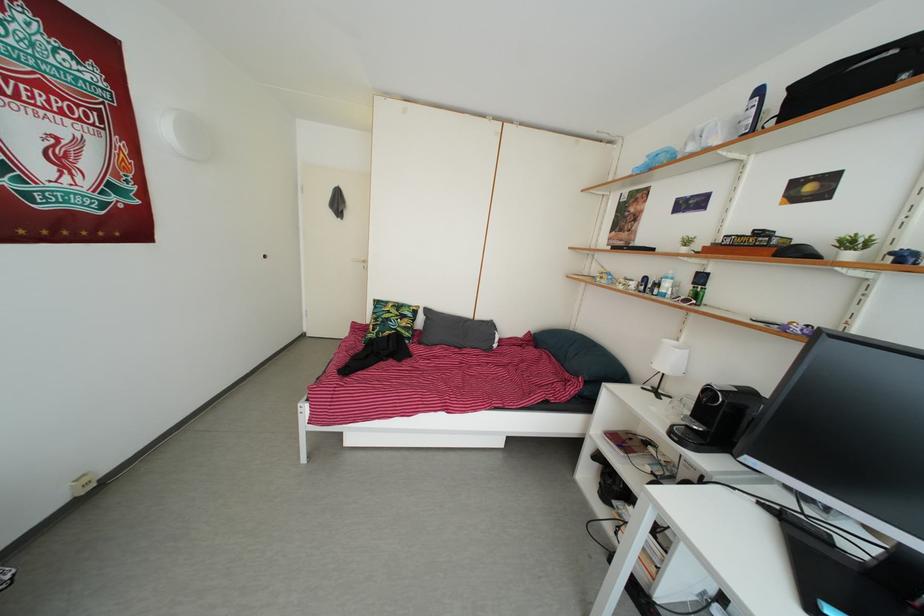
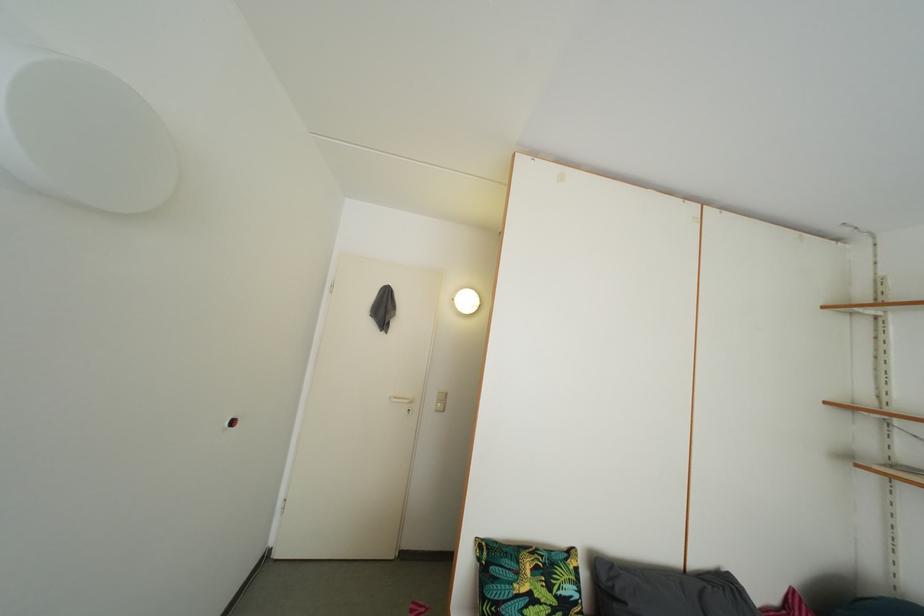
The point at (x=394, y=310) is marked in the first image. Where is the corresponding point in the second image?

(521, 562)